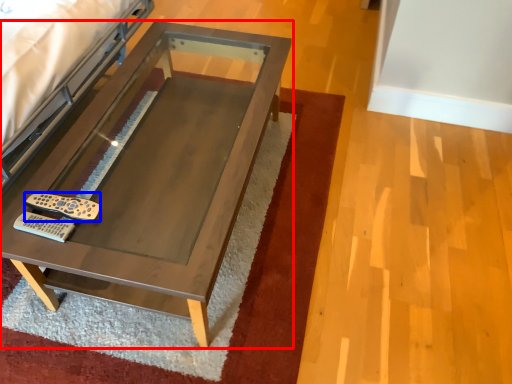
Question: Which object is further to the camera taking this photo, table (highlighted by a red box) or remote (highlighted by a blue box)?

Choices:
 (A) table
 (B) remote

Answer: (B)